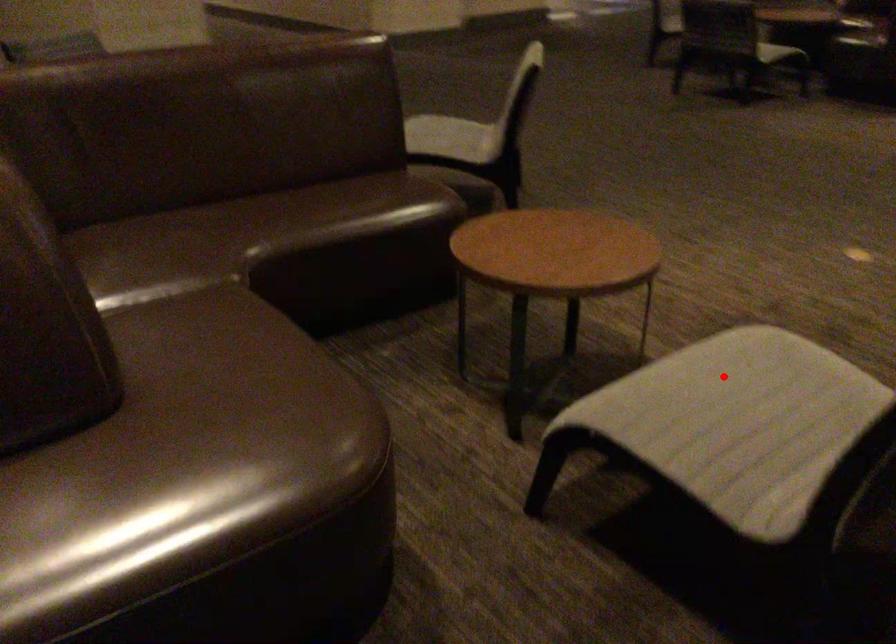
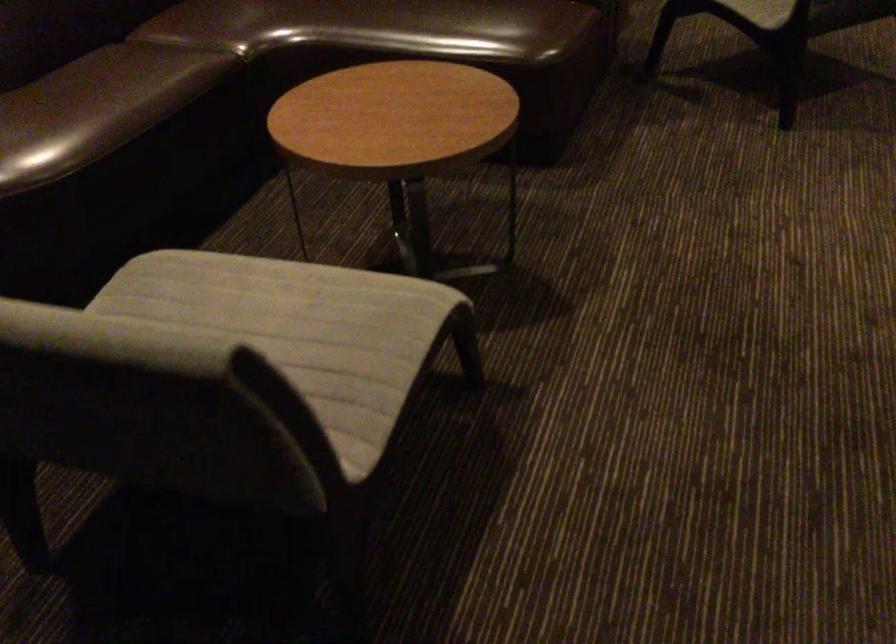
Where in the second image is the point corresponding to the highlighted location from the first image?

(280, 299)